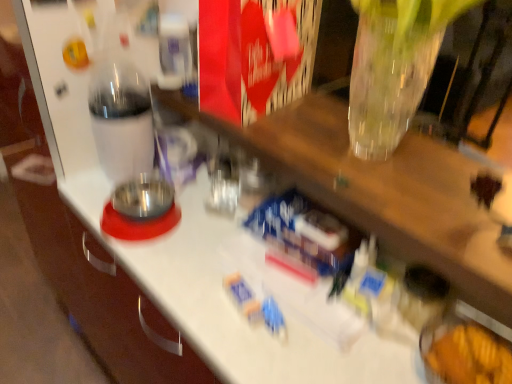
You are a GUI agent. You are given a task and a screenshot of the screen. Output one action in this format:
    pyautogui.click(x=<x>, y=<y>)
    Task: Click on the empty space that is ontop of blue plastic toy at center, placed as the first toy when sorted from top to bottom
    
    Given the screenshot: What is the action you would take?
    pyautogui.click(x=310, y=233)